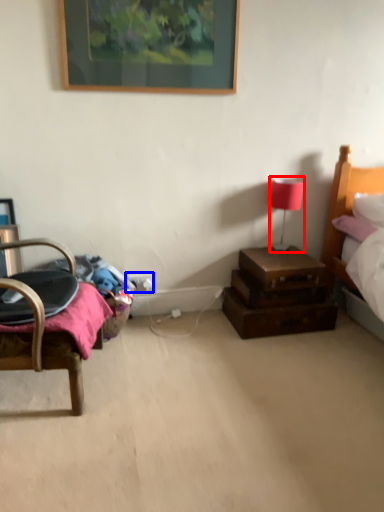
Question: Among these objects, which one is nearest to the camera, table lamp (highlighted by a red box) or electric outlet (highlighted by a blue box)?

Choices:
 (A) table lamp
 (B) electric outlet

Answer: (A)